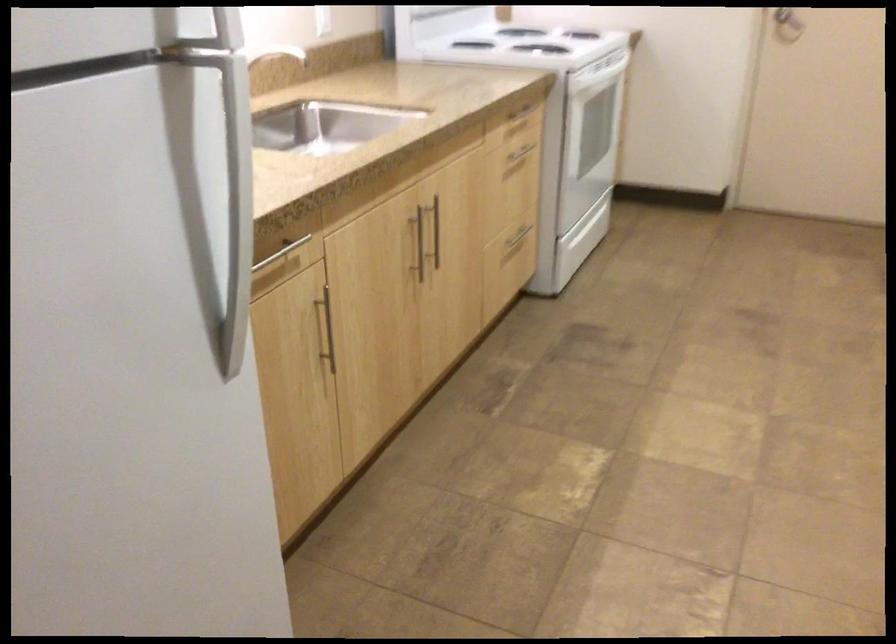
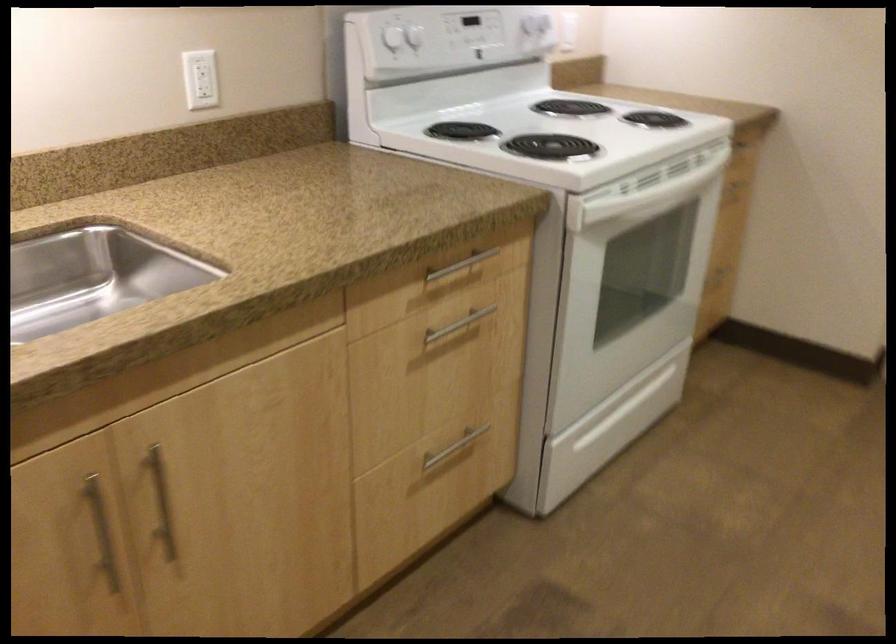
Locate, in the second image, the point that corresponds to pixel 426 239 in the first image.

(161, 502)